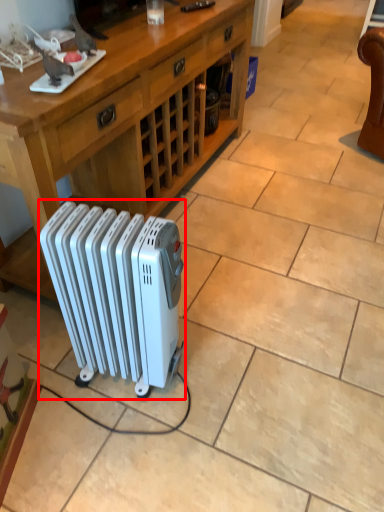
Question: From the image's perspective, where is radiator (annotated by the red box) located in relation to desk in the image?

Choices:
 (A) above
 (B) below

Answer: (B)